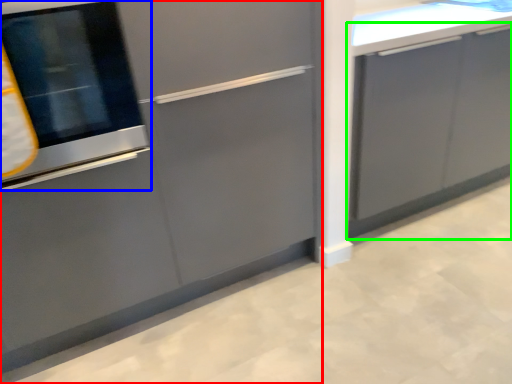
Question: Estimate the real-world distances between objects in this image. Which object is closer to cabinetry (highlighted by a red box), oven (highlighted by a blue box) or cabinetry (highlighted by a green box)?

Choices:
 (A) oven
 (B) cabinetry

Answer: (A)